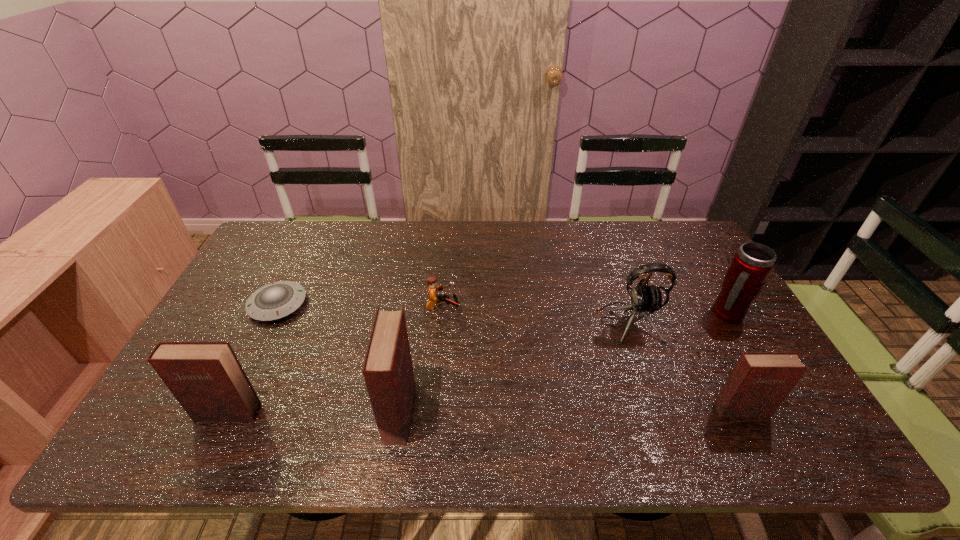
At what (x,y) coordinates should I click in order to perform the action: click on free space located 0.060m holding a crossbow in the hands of the sixth tallest object. Please return your answer as a coordinate pair (x, y). This screenshot has height=540, width=960. Looking at the image, I should click on (480, 308).

At what (x,y) coordinates should I click in order to perform the action: click on vacant region located on the left of the fifth object from left to right. Please return your answer as a coordinate pair (x, y). This screenshot has height=540, width=960. Looking at the image, I should click on (501, 322).

Identify the location of free space located 0.360m on the back of the saucer. This screenshot has width=960, height=540. (319, 221).

I want to click on vacant region located on the side with the handle of the thermos bottle, so click(x=785, y=414).

I want to click on diary at the left edge, so click(x=206, y=378).

At what (x,y) coordinates should I click in order to perform the action: click on saucer located in the left edge section of the desktop. Please return your answer as a coordinate pair (x, y). The height and width of the screenshot is (540, 960). Looking at the image, I should click on click(x=276, y=300).

Find the location of a particular element. The width and height of the screenshot is (960, 540). diary positioned at the right edge is located at coordinates (760, 381).

Find the location of a particular element. The height and width of the screenshot is (540, 960). thermos bottle situated at the right edge is located at coordinates (752, 264).

This screenshot has width=960, height=540. I want to click on object situated at the near left corner, so click(206, 378).

Where is `object situated at the near right corner`? Image resolution: width=960 pixels, height=540 pixels. object situated at the near right corner is located at coordinates (760, 381).